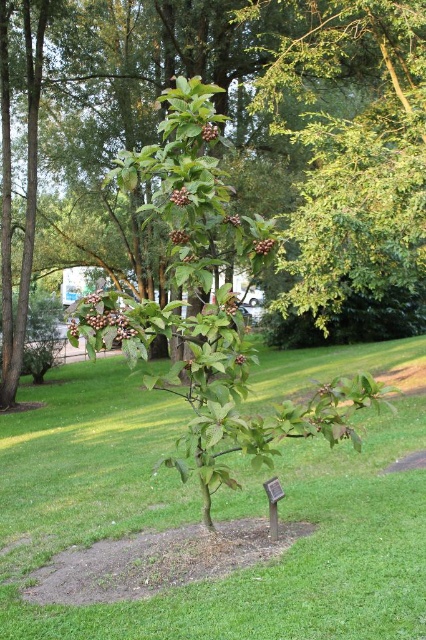
Question: Which of the following is the closest to the observer?

Choices:
 (A) (143, 145)
 (B) (238, 358)

Answer: (B)

Question: Is glossy berry at center positioned at the back of green matte flower at center?

Choices:
 (A) no
 (B) yes

Answer: (A)

Question: Can you confirm if brown matte berries at center is bigger than purple matte berries at center?

Choices:
 (A) no
 (B) yes

Answer: (A)

Question: Does green leafy tree at center appear on the right side of purple matte berries at center?

Choices:
 (A) yes
 (B) no

Answer: (A)

Question: Estimate the real-world distances between objects in this image. Which object is closer to the green leafy tree at center?

Choices:
 (A) green matte flower at center
 (B) brown matte berries at center
 (C) green glossy tree at upper center

Answer: (C)

Question: Which point is closer to the camera?

Choices:
 (A) green grass at center
 (B) brown matte berries at center
 (C) glossy berry at center

Answer: (A)